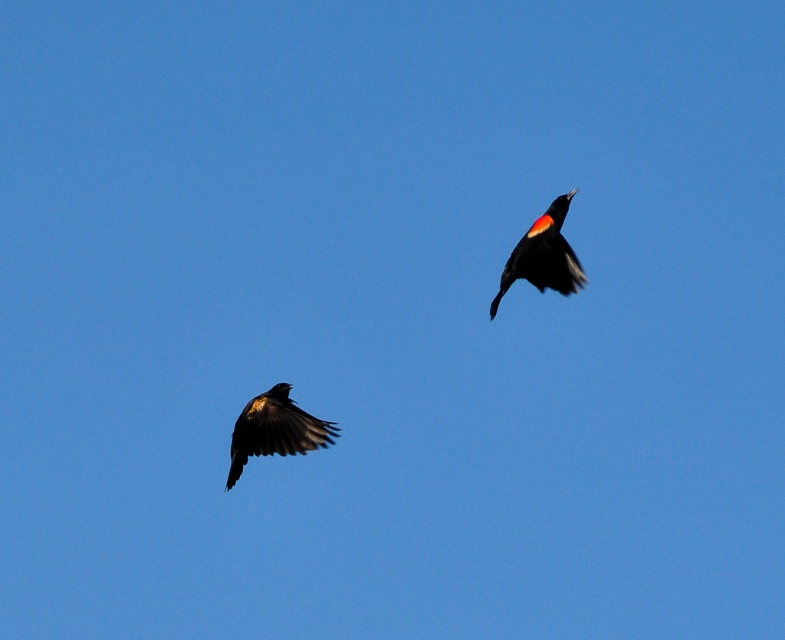
Who is lower down, shiny black bird at lower left or shiny black bird at upper right?

shiny black bird at lower left is lower down.

Where is `shiny black bird at lower left`? Image resolution: width=785 pixels, height=640 pixels. shiny black bird at lower left is located at coordinates pos(274,429).

Locate an element on the screen. shiny black bird at lower left is located at coordinates (274, 429).